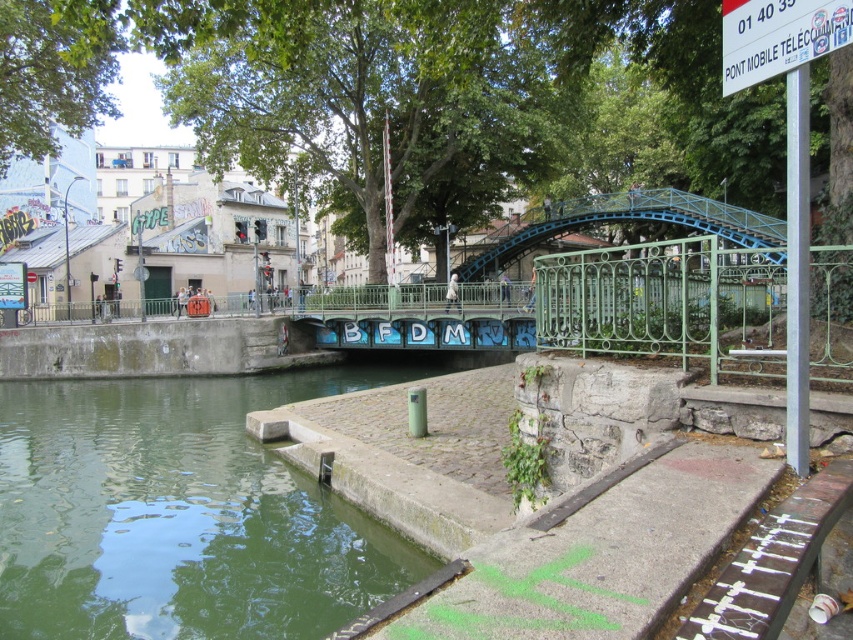
You are a drone operator trying to capture a photo of the bridge and the graffiti. Your drone is currently hovering at point A, which is at coordinates point (x=35, y=566). You want to move it to point B, which is at coordinates point (x=837, y=45). From your current position at point A, will moving towards point B make the drone go closer to or farther from the viewer?

Point (x=35, y=566) is further to the viewer than point (x=837, y=45). Moving the drone from point A to point B will make it go farther from the viewer.

You are standing at the center of the bridge and want to get to the green concrete river at lower left. Which direction should you walk to reach it?

The green concrete river at lower left is located at point (183, 512), so you should walk towards the lower left direction to reach it.